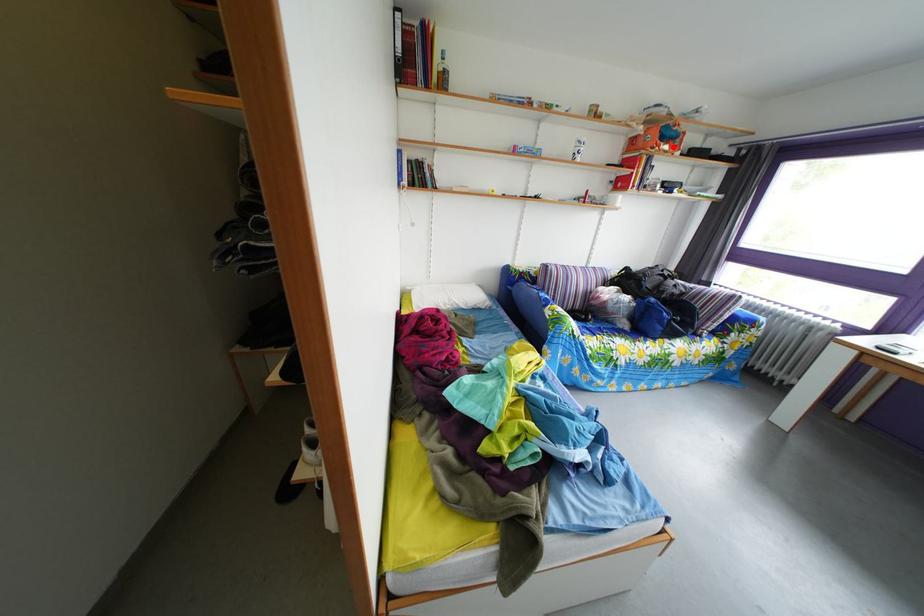
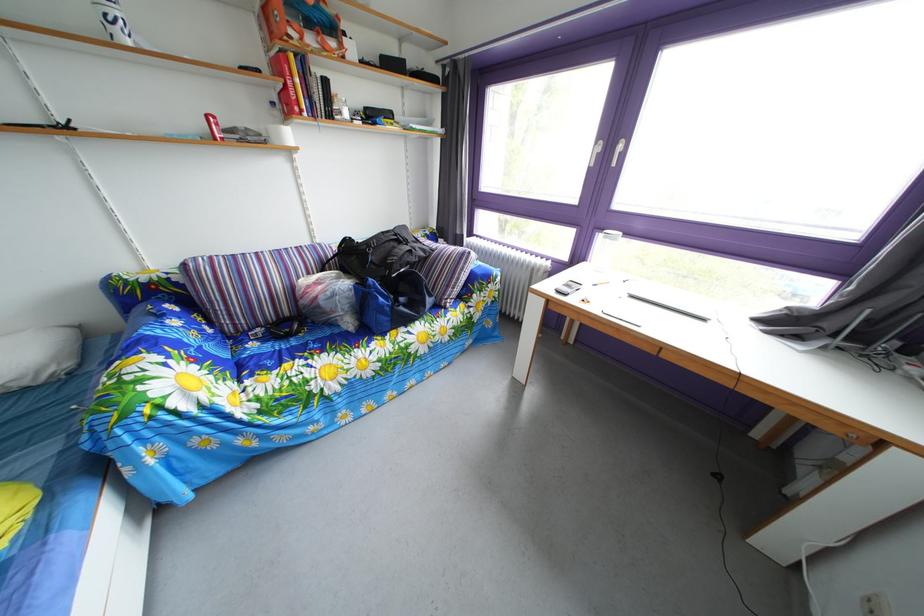
Where in the second image is the point corresponding to the highlighted location from the first image?

(320, 33)